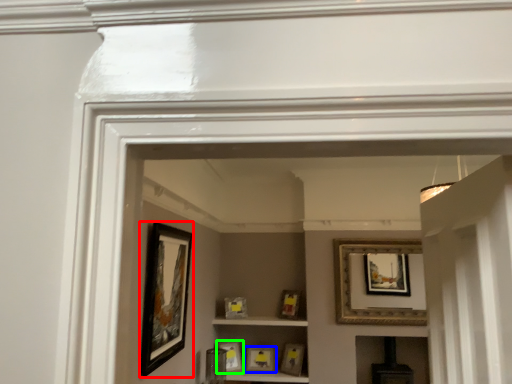
Question: Estimate the real-world distances between objects in this image. Which object is farther from picture frame (highlighted by a red box), picture frame (highlighted by a blue box) or picture frame (highlighted by a green box)?

Choices:
 (A) picture frame
 (B) picture frame

Answer: (A)